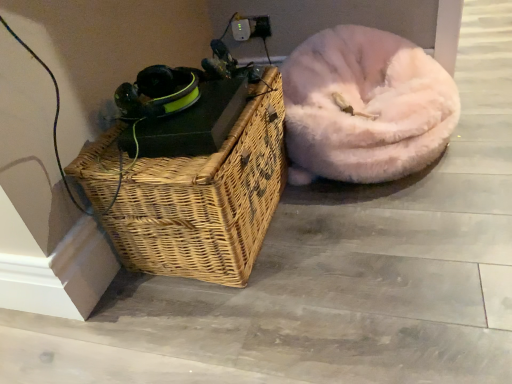
This screenshot has height=384, width=512. I want to click on space that is in front of fuzzy pink dog bed at right, so click(387, 254).